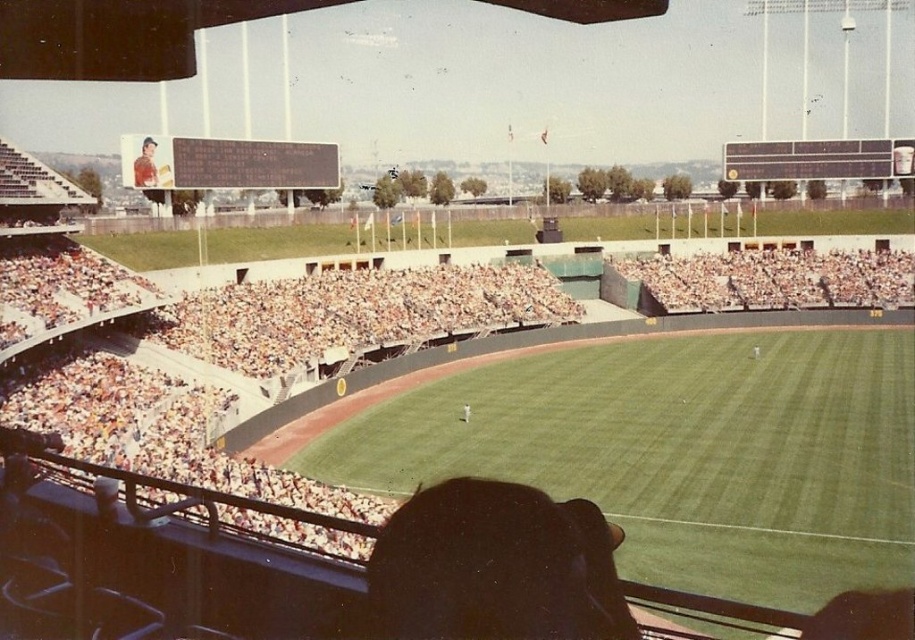
You are a photographer standing at the edge of the baseball field. You want to take a photo that includes both the brown leather jacket at upper left and the white uniform person at center. Which object should you position closer to the bottom of your camera frame?

The brown leather jacket at upper left should be positioned closer to the bottom of the camera frame because it has a lesser height compared to the white uniform person at center.

You are a photographer at the baseball stadium and want to take a photo of the white uniform person at center without the brown leather jacket at upper left blocking the view. Is this possible given their positions?

The white uniform person at center is behind the brown leather jacket at upper left, so taking a photo without the jacket blocking would require adjusting the angle or moving the camera to ensure the jacket is not in front of the person.

You are a photographer standing at the camera position in the baseball stadium. You want to take a closeup shot of the brown leather jacket at upper left. Given that your telephoto lens has a maximum effective range of 250 feet, will you be able to capture a clear image of the jacket?

The brown leather jacket at upper left is 291.84 feet away from the camera, which exceeds the telephoto lens maximum effective range of 250 feet. Therefore, you won QAQ not capture a clear image of the jacket.